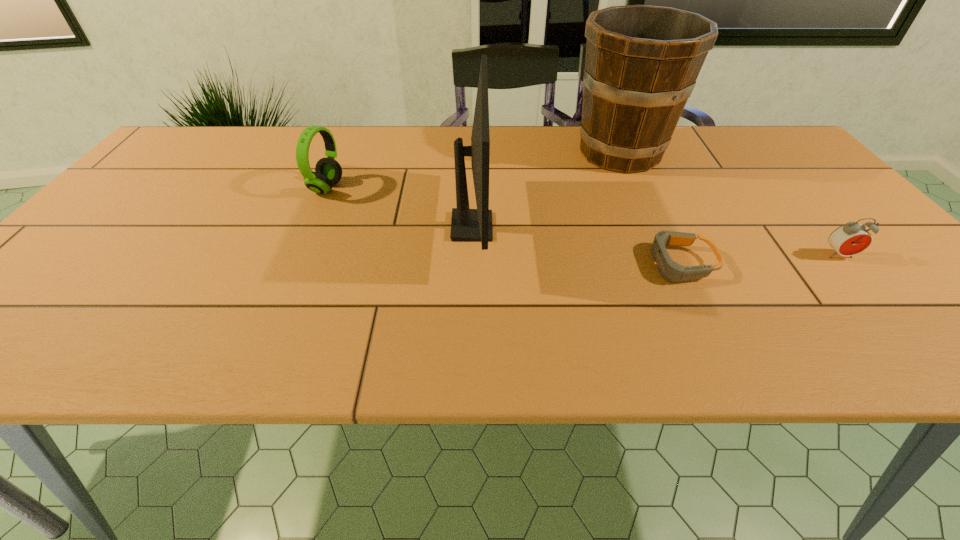
In the image, there is a desktop. Where is `vacant space at the far right corner`? The height and width of the screenshot is (540, 960). vacant space at the far right corner is located at coordinates (770, 140).

This screenshot has width=960, height=540. Identify the location of free point between the bucket and the rightmost object. (730, 204).

I want to click on vacant area that lies between the goggles and the third shortest object, so pyautogui.click(x=503, y=226).

Where is `free space that is in between the shortest object and the computer monitor`? free space that is in between the shortest object and the computer monitor is located at coordinates (576, 245).

Where is `free space between the shortest object and the computer monitor`? free space between the shortest object and the computer monitor is located at coordinates (576, 245).

The height and width of the screenshot is (540, 960). Find the location of `empty location between the headset and the alarm clock`. empty location between the headset and the alarm clock is located at coordinates (583, 222).

Locate an element on the screen. This screenshot has height=540, width=960. unoccupied area between the second object from left to right and the bucket is located at coordinates (x=546, y=190).

Find the location of a particular element. The height and width of the screenshot is (540, 960). free area in between the alarm clock and the goggles is located at coordinates (759, 260).

Where is `vacant space in between the goggles and the second object from left to right`? vacant space in between the goggles and the second object from left to right is located at coordinates (576, 245).

Where is `vacant point located between the headset and the second shortest object`? Image resolution: width=960 pixels, height=540 pixels. vacant point located between the headset and the second shortest object is located at coordinates (583, 222).